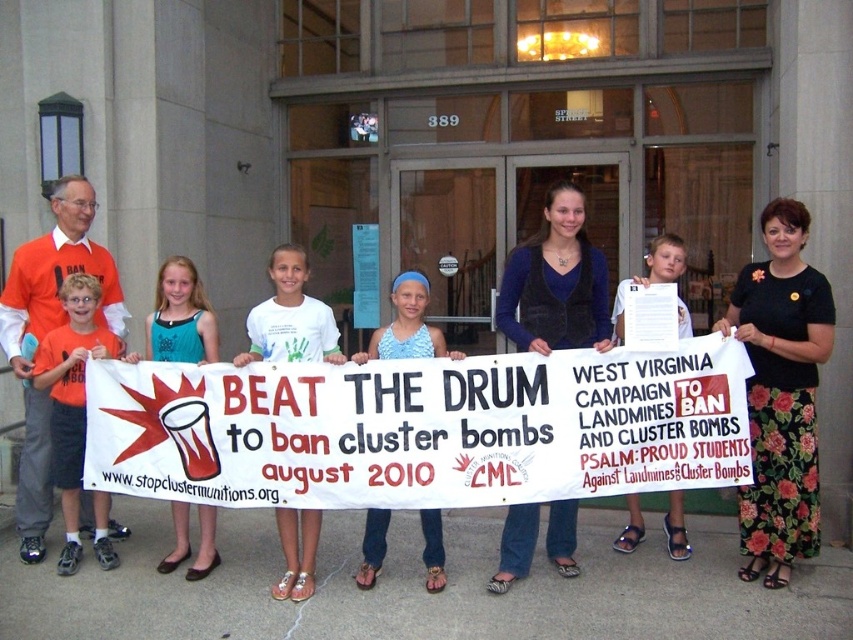
You are a photographer at the event and want to ensure both the teal fabric dress at center and the white paper at center are fully visible in your photo. Given that your camera has a fixed width, which object requires a wider frame to capture entirely?

The white paper at center requires a wider frame because its width is greater than the teal fabric dress at center.

You are a photographer at the event and want to ensure both the teal fabric dress at center and the blue printed tank top at center are clearly visible in your photo. Which clothing item should you focus on first to ensure it doesn not get cropped out due to its size?

The teal fabric dress at center is taller than the blue printed tank top at center, so you should focus on capturing the teal fabric dress at center first to avoid cropping it out due to its larger height.